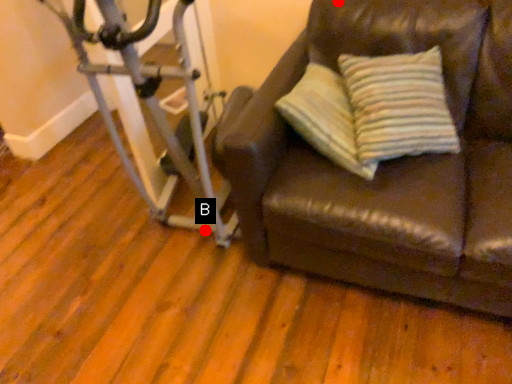
Question: Two points are circled on the image, labeled by A and B beside each circle. Which of the following is the farthest from the observer?

Choices:
 (A) A is further
 (B) B is further

Answer: (B)